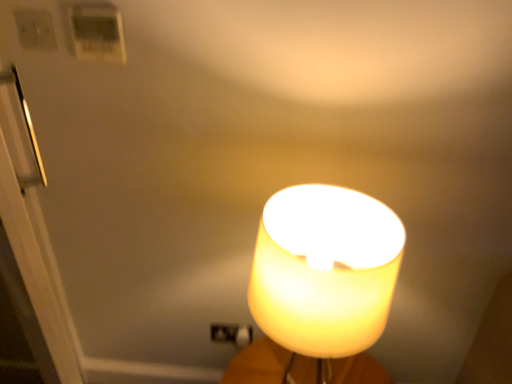
Question: Is white glossy door at left at the back of white plastic thermostat at upper left, arranged as the first light switch when viewed from the right?

Choices:
 (A) yes
 (B) no

Answer: (B)

Question: Would you say white plastic thermostat at upper left, arranged as the first light switch when viewed from the right, contains white glossy door at left?

Choices:
 (A) no
 (B) yes

Answer: (A)

Question: Can you confirm if white plastic thermostat at upper left, the second light switch in the left-to-right sequence, is positioned to the right of white glossy door at left?

Choices:
 (A) no
 (B) yes

Answer: (B)

Question: Are white plastic thermostat at upper left, the second light switch in the left-to-right sequence, and white glossy door at left beside each other?

Choices:
 (A) no
 (B) yes

Answer: (A)

Question: Does white plastic thermostat at upper left, the second light switch in the left-to-right sequence, have a lesser height compared to white glossy door at left?

Choices:
 (A) yes
 (B) no

Answer: (A)

Question: Considering their positions, is white plastic light switch at upper left, the 1th light switch positioned from the left, located in front of or behind white plastic thermostat at upper left, arranged as the first light switch when viewed from the right?

Choices:
 (A) front
 (B) behind

Answer: (B)

Question: From a real-world perspective, relative to white plastic thermostat at upper left, arranged as the first light switch when viewed from the right, is white plastic light switch at upper left, placed as the 2th light switch when sorted from right to left, vertically above or below?

Choices:
 (A) above
 (B) below

Answer: (A)

Question: Considering the positions of point (29, 48) and point (95, 51), is point (29, 48) closer or farther from the camera than point (95, 51)?

Choices:
 (A) closer
 (B) farther

Answer: (B)

Question: Based on their sizes in the image, would you say white plastic light switch at upper left, placed as the 2th light switch when sorted from right to left, is bigger or smaller than white plastic thermostat at upper left, arranged as the first light switch when viewed from the right?

Choices:
 (A) small
 (B) big

Answer: (A)

Question: In the image, is white plastic light switch at upper left, the 1th light switch positioned from the left, on the left side or the right side of white glossy door at left?

Choices:
 (A) right
 (B) left

Answer: (A)

Question: Is white plastic light switch at upper left, placed as the 2th light switch when sorted from right to left, inside or outside of white glossy door at left?

Choices:
 (A) outside
 (B) inside

Answer: (A)

Question: Based on their sizes in the image, would you say white plastic light switch at upper left, the 1th light switch positioned from the left, is bigger or smaller than white glossy door at left?

Choices:
 (A) small
 (B) big

Answer: (A)

Question: From their relative heights in the image, would you say white plastic light switch at upper left, the 1th light switch positioned from the left, is taller or shorter than white glossy door at left?

Choices:
 (A) tall
 (B) short

Answer: (B)

Question: Would you say white glossy door at left is inside or outside translucent yellow lampshade at center?

Choices:
 (A) outside
 (B) inside

Answer: (A)

Question: From the image's perspective, relative to translucent yellow lampshade at center, is white glossy door at left above or below?

Choices:
 (A) above
 (B) below

Answer: (B)